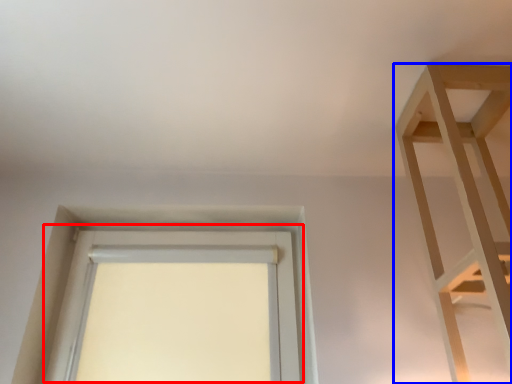
Question: Which point is closer to the camera, window (highlighted by a red box) or shelf (highlighted by a blue box)?

Choices:
 (A) window
 (B) shelf

Answer: (B)